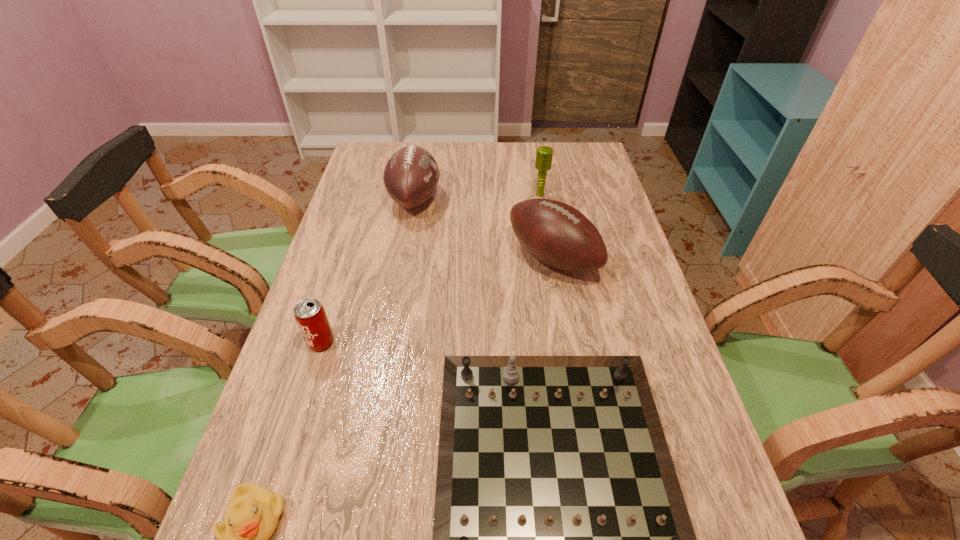
Find the location of a particular element. This screenshot has height=540, width=960. the fourth object from right to left is located at coordinates (411, 175).

In order to click on the left football (American) in this screenshot , I will do `click(411, 175)`.

The image size is (960, 540). What are the coordinates of `the third farthest object` in the screenshot? It's located at (556, 234).

Find the location of a particular element. the right football (American) is located at coordinates (556, 234).

You are a GUI agent. You are given a task and a screenshot of the screen. Output one action in this format:
    pyautogui.click(x=<x>, y=<y>)
    Task: Click on the microphone
    
    Given the screenshot: What is the action you would take?
    pyautogui.click(x=544, y=154)

Identify the location of the third nearest object. (309, 313).

Locate an element on the screen. the fourth tallest object is located at coordinates (309, 313).

What are the coordinates of `vacant space located 0.360m on the front of the farther football (American)` in the screenshot? It's located at (394, 314).

Locate an element on the screen. free space located 0.110m on the back of the nearer football (American) is located at coordinates (544, 208).

Where is `vacant region located 0.350m on the left of the microphone`? vacant region located 0.350m on the left of the microphone is located at coordinates (427, 195).